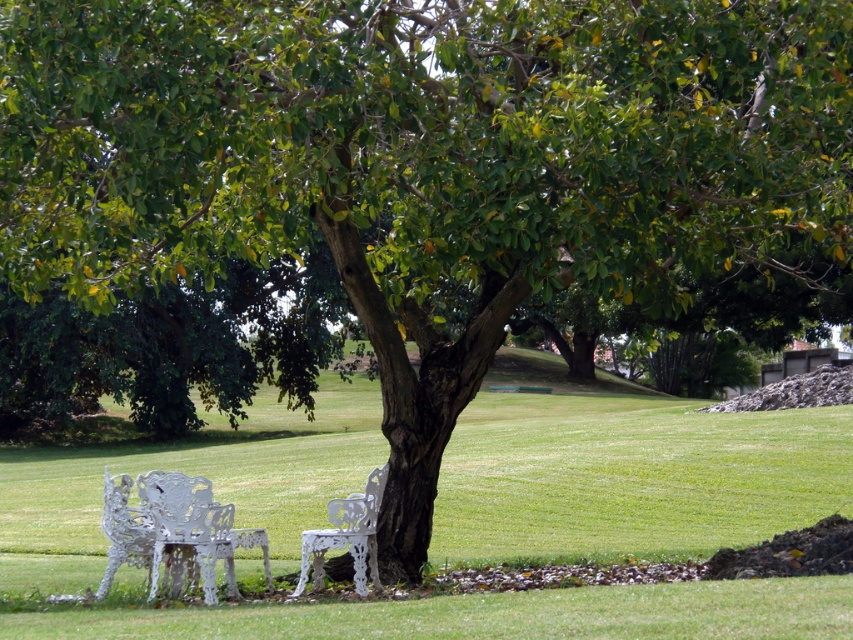
Looking at this image, between white metal bench at lower left and white wrought iron bench at center, which one appears on the right side from the viewer's perspective?

From the viewer's perspective, white wrought iron bench at center appears more on the right side.

Is white metal bench at lower left further to the viewer compared to white wrought iron bench at center?

No, it is not.

Does point (235, 596) come closer to viewer compared to point (347, 522)?

Yes, point (235, 596) is in front of point (347, 522).

Identify the location of white metal bench at lower left. (173, 532).

Is green grass at center bigger than white metal bench at lower left?

Yes.

Who is taller, green grass at center or white metal bench at lower left?

green grass at center is taller.

Which is behind, point (15, 467) or point (138, 512)?

Positioned behind is point (15, 467).

Image resolution: width=853 pixels, height=640 pixels. I want to click on green grass at center, so click(627, 472).

Which is behind, point (607, 627) or point (370, 516)?

The point (370, 516) is more distant.

Can you confirm if green grass at center is thinner than white wrought iron bench at center?

No, green grass at center is not thinner than white wrought iron bench at center.

Which is behind, point (766, 524) or point (373, 564)?

The point (766, 524) is more distant.

Image resolution: width=853 pixels, height=640 pixels. I want to click on green grass at center, so click(x=627, y=472).